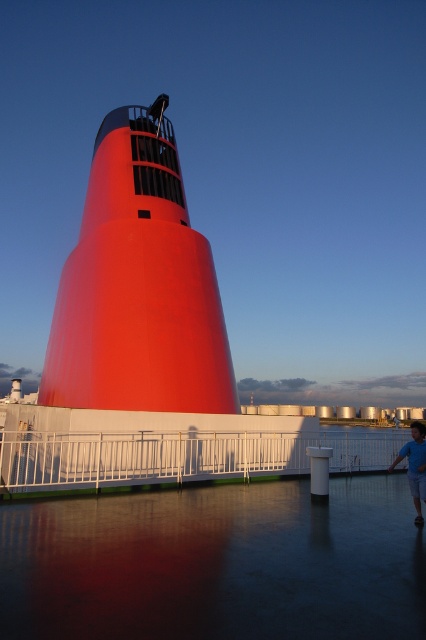
Question: Estimate the real-world distances between objects in this image. Which object is farther from the white metal railing at center?

Choices:
 (A) smooth glossy red tower at center
 (B) blue cotton shirt at lower right

Answer: (A)

Question: Is smooth glossy red tower at center wider than white metal railing at center?

Choices:
 (A) no
 (B) yes

Answer: (A)

Question: Is white metal railing at center bigger than blue cotton shirt at lower right?

Choices:
 (A) yes
 (B) no

Answer: (A)

Question: Which of the following is the closest to the observer?

Choices:
 (A) white metal railing at center
 (B) blue cotton shirt at lower right
 (C) smooth glossy red tower at center

Answer: (B)

Question: Is smooth glossy red tower at center positioned behind white metal railing at center?

Choices:
 (A) yes
 (B) no

Answer: (A)

Question: Which object appears closest to the camera in this image?

Choices:
 (A) smooth glossy red tower at center
 (B) white metal railing at center

Answer: (B)